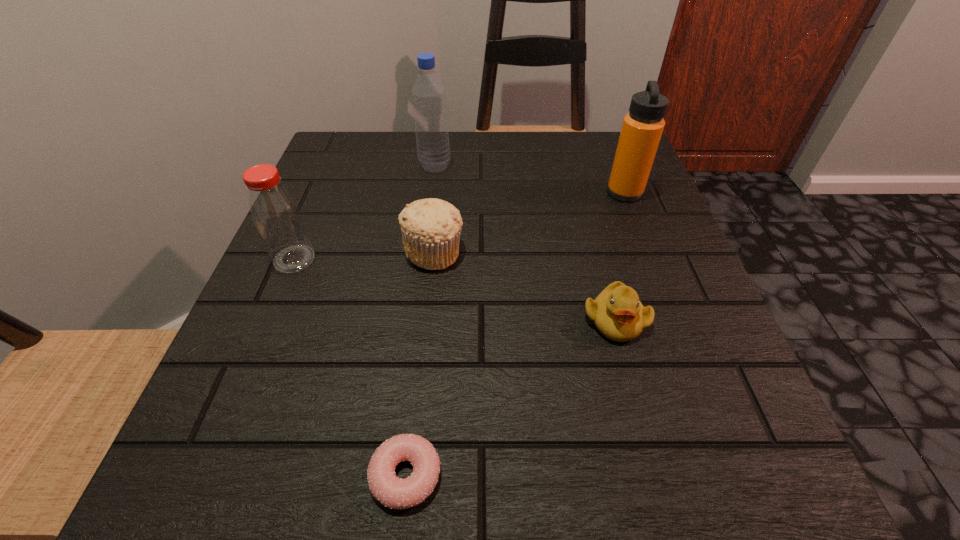
In the image, there is a desktop. At what (x,y) coordinates should I click in order to perform the action: click on vacant region at the far right corner. Please return your answer as a coordinate pair (x, y). Looking at the image, I should click on (582, 156).

In the image, there is a desktop. Where is `vacant region at the near right corner`? vacant region at the near right corner is located at coordinates (763, 450).

Image resolution: width=960 pixels, height=540 pixels. I want to click on empty space that is in between the second object from right to left and the nearest object, so click(x=511, y=397).

Locate an element on the screen. free space that is in between the shortest object and the second nearest object is located at coordinates (511, 397).

What are the coordinates of `unoccupied area between the third shortest object and the doughnut` in the screenshot? It's located at (420, 363).

I want to click on free space that is in between the doughnut and the farthest object, so click(x=420, y=320).

Locate an element on the screen. blank region between the fifth farthest object and the leftmost object is located at coordinates (455, 289).

I want to click on vacant region between the nearest object and the farthest object, so click(420, 320).

At what (x,y) coordinates should I click in order to perform the action: click on free spot between the fourth tallest object and the nearest object. Please return your answer as a coordinate pair (x, y). Image resolution: width=960 pixels, height=540 pixels. Looking at the image, I should click on (420, 363).

Locate an element on the screen. The image size is (960, 540). vacant area that lies between the rightmost object and the muffin is located at coordinates (529, 222).